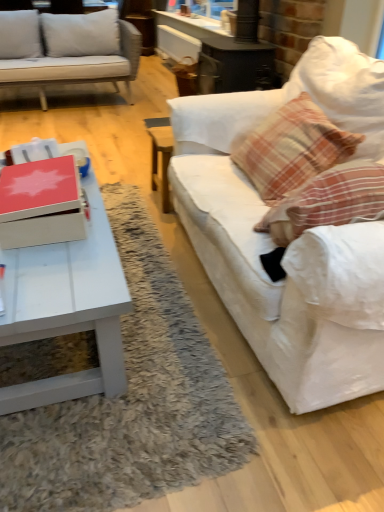
Question: Is matte red box at center surrounding white matte coffee table at lower left?

Choices:
 (A) no
 (B) yes

Answer: (A)

Question: From a real-world perspective, is matte red box at center physically above white matte coffee table at lower left?

Choices:
 (A) no
 (B) yes

Answer: (B)

Question: Is matte red box at center facing away from white matte coffee table at lower left?

Choices:
 (A) yes
 (B) no

Answer: (B)

Question: Is matte red box at center taller than white matte coffee table at lower left?

Choices:
 (A) yes
 (B) no

Answer: (B)

Question: Does matte red box at center have a smaller size compared to white matte coffee table at lower left?

Choices:
 (A) yes
 (B) no

Answer: (A)

Question: From a real-world perspective, is matte red box at center physically below white matte coffee table at lower left?

Choices:
 (A) yes
 (B) no

Answer: (B)

Question: Is matte red box at center turned away from plaid fabric pillow at right?

Choices:
 (A) yes
 (B) no

Answer: (B)

Question: Is matte red box at center positioned in front of plaid fabric pillow at right?

Choices:
 (A) no
 (B) yes

Answer: (B)

Question: Is matte red box at center not close to plaid fabric pillow at right?

Choices:
 (A) no
 (B) yes

Answer: (A)

Question: Can you confirm if matte red box at center is positioned to the left of plaid fabric pillow at right?

Choices:
 (A) yes
 (B) no

Answer: (A)

Question: Does matte red box at center have a larger size compared to plaid fabric pillow at right?

Choices:
 (A) yes
 (B) no

Answer: (B)

Question: Is matte red box at center to the right of plaid fabric pillow at right from the viewer's perspective?

Choices:
 (A) no
 (B) yes

Answer: (A)

Question: Is plaid fabric pillow at right smaller than white fabric couch at right?

Choices:
 (A) no
 (B) yes

Answer: (B)